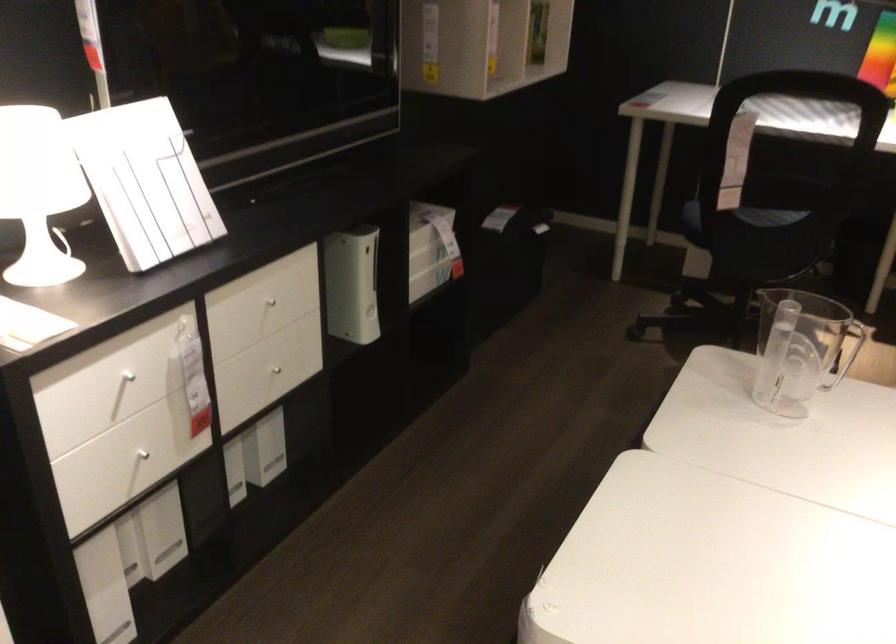
Where would you sit the chair sitting surface? Please return your answer as a coordinate pair (x, y).

(739, 218)